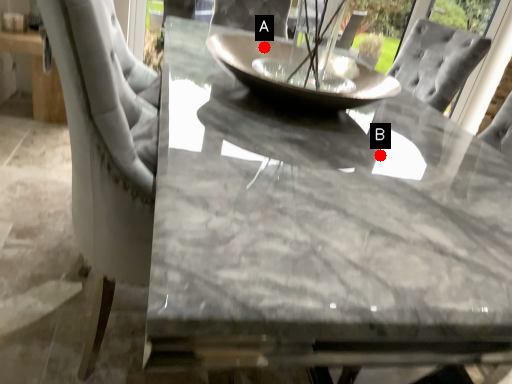
Question: Two points are circled on the image, labeled by A and B beside each circle. Which point is closer to the camera?

Choices:
 (A) A is closer
 (B) B is closer

Answer: (B)